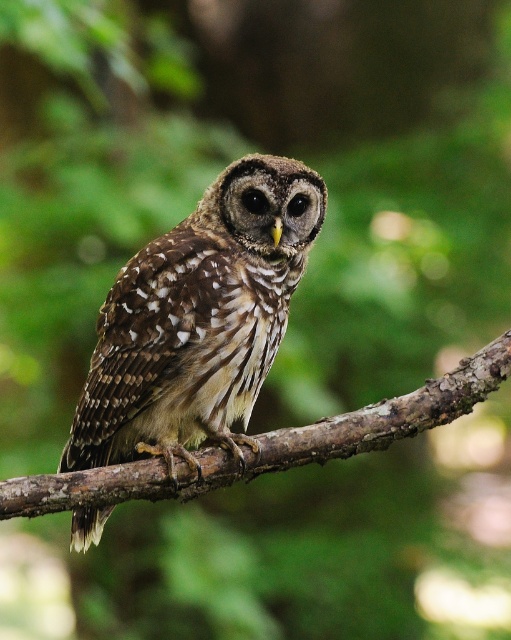
Is brown speckled owl at center shorter than brown rough branch at center?

No.

I want to click on brown speckled owl at center, so click(x=197, y=321).

The width and height of the screenshot is (511, 640). Describe the element at coordinates (197, 321) in the screenshot. I see `brown speckled owl at center` at that location.

At what (x,y) coordinates should I click in order to perform the action: click on brown speckled owl at center. Please return your answer as a coordinate pair (x, y). Looking at the image, I should click on (197, 321).